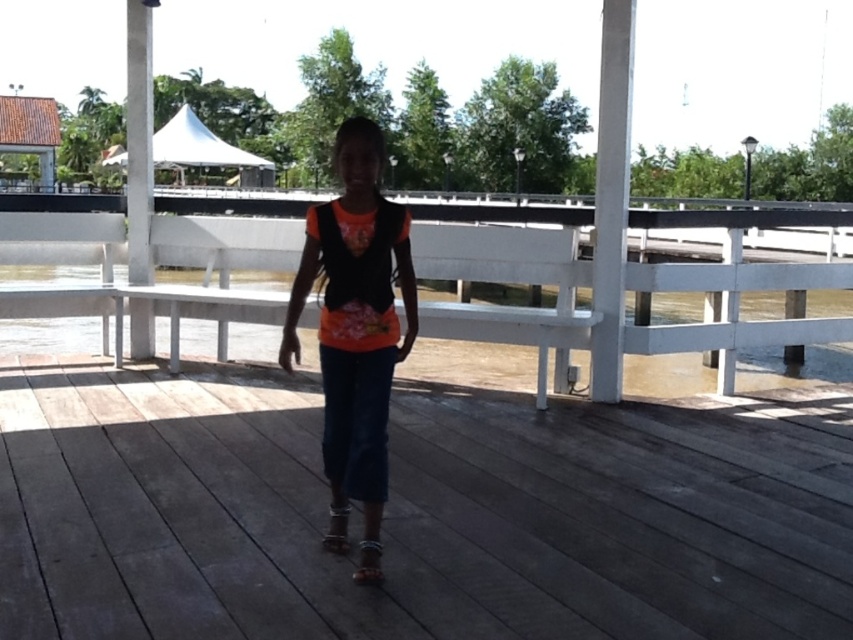
Question: Which point is closer to the camera taking this photo?

Choices:
 (A) (270, 301)
 (B) (341, 449)

Answer: (B)

Question: Is white wooden porch at center closer to the viewer compared to orange matte shirt at center?

Choices:
 (A) no
 (B) yes

Answer: (A)

Question: Which of the following is the closest to the observer?

Choices:
 (A) orange matte shirt at center
 (B) brown wooden deck at center

Answer: (B)

Question: Considering the real-world distances, which object is farthest from the white wooden porch at center?

Choices:
 (A) brown wooden deck at center
 (B) orange matte shirt at center

Answer: (B)

Question: Can you confirm if brown wooden deck at center is wider than orange matte shirt at center?

Choices:
 (A) yes
 (B) no

Answer: (A)

Question: Is brown wooden deck at center above white wooden porch at center?

Choices:
 (A) no
 (B) yes

Answer: (A)